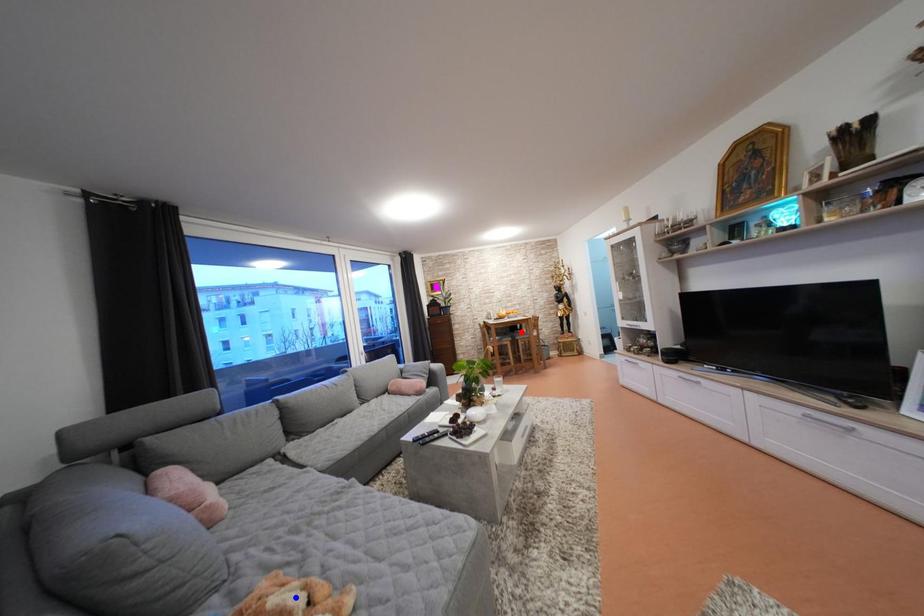
Question: Two points are marked on the image. Which point is closer to the camera?

Choices:
 (A) Blue point is closer.
 (B) Red point is closer.

Answer: (A)